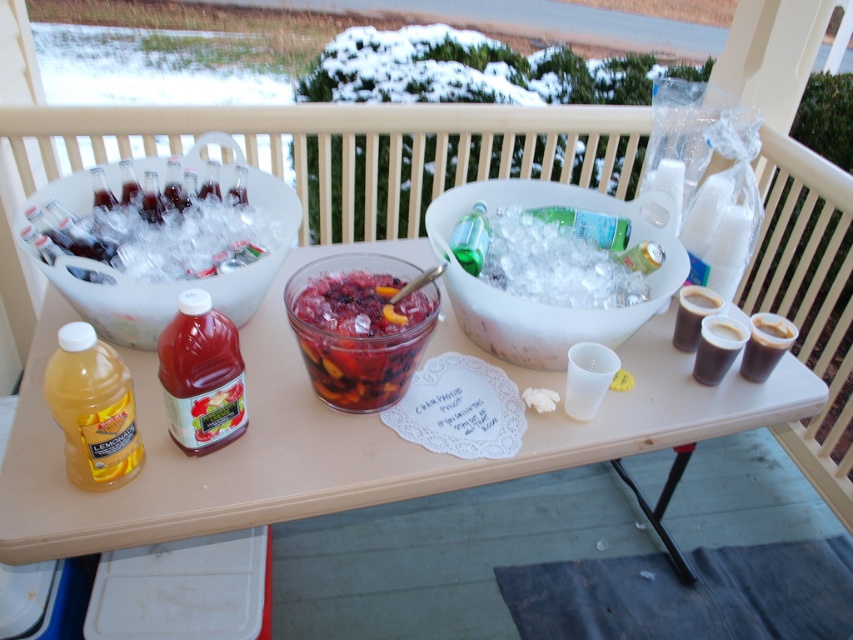
You are organizing a winter party and need to serve drinks. You have a translucent glass punch bowl at center and a dark brown glass at right. Which container can hold more liquid?

The translucent glass punch bowl at center can hold more liquid because it is bigger than the dark brown glass at right.

Based on the photo, you are setting up a beverage station and need to place a tall pitcher that requires 15 cm of vertical space. You have two options on the table, the translucent glass punch bowl at center and the green glass bottle at center. Which one can accommodate the pitcher?

The translucent glass punch bowl at center has a greater height compared to the green glass bottle at center, so it can accommodate the tall pitcher needing 15 cm of vertical space.